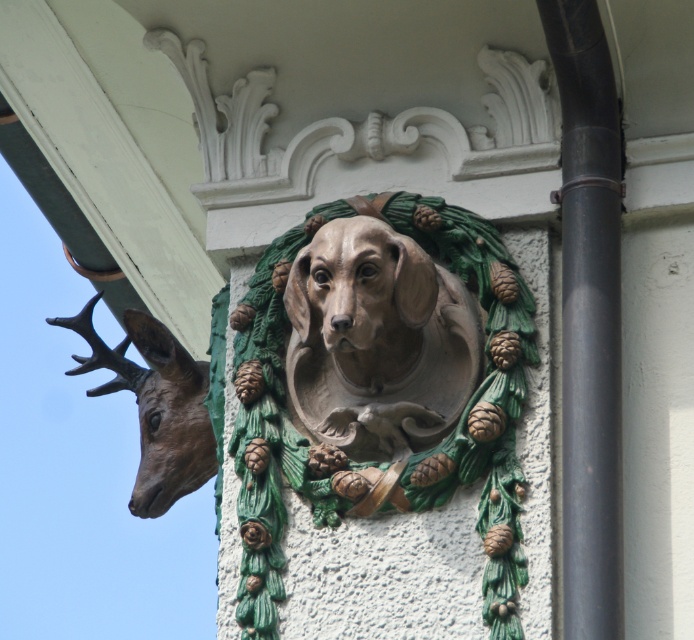
Can you confirm if matte gray stone dog at center is thinner than black matte pipe at right?

Correct, matte gray stone dog at center's width is less than black matte pipe at right's.

Can you confirm if matte gray stone dog at center is positioned above black matte pipe at right?

Yes, matte gray stone dog at center is above black matte pipe at right.

Find the location of `matte gray stone dog at center`. matte gray stone dog at center is located at coordinates coord(378,340).

Between point (391, 266) and point (169, 496), which one is positioned in front?

Point (391, 266)

Image resolution: width=694 pixels, height=640 pixels. What do you see at coordinates (378, 340) in the screenshot?
I see `matte gray stone dog at center` at bounding box center [378, 340].

Which is behind, point (350, 410) or point (126, 388)?

Positioned behind is point (126, 388).

Image resolution: width=694 pixels, height=640 pixels. Find the location of `matte gray stone dog at center`. matte gray stone dog at center is located at coordinates (378, 340).

Which is above, black matte pipe at right or bronze textured deer head at left?

black matte pipe at right

Can you confirm if black matte pipe at right is positioned to the right of bronze textured deer head at left?

Indeed, black matte pipe at right is positioned on the right side of bronze textured deer head at left.

Is point (593, 346) less distant than point (196, 486)?

Yes.

Where is `black matte pipe at right`? The height and width of the screenshot is (640, 694). black matte pipe at right is located at coordinates (589, 317).